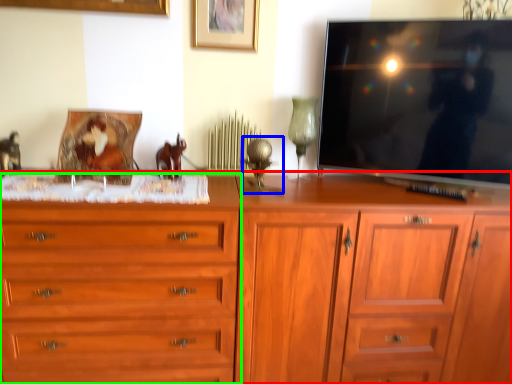
Question: Which object is positioned closest to chest of drawers (highlighted by a red box)? Select from table lamp (highlighted by a blue box) and chest of drawers (highlighted by a green box).

Choices:
 (A) table lamp
 (B) chest of drawers

Answer: (B)